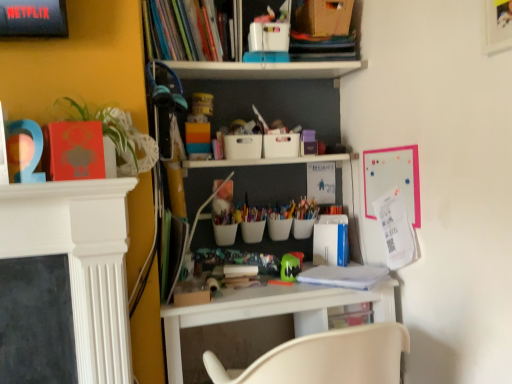
Question: Can you confirm if hardcover books at upper center, which is the 1th book from top to bottom, is taller than white plastic desk at center?

Choices:
 (A) no
 (B) yes

Answer: (A)

Question: Is hardcover books at upper center, which is the 1th book from top to bottom, closer to camera compared to white plastic desk at center?

Choices:
 (A) no
 (B) yes

Answer: (A)

Question: From a real-world perspective, is hardcover books at upper center, which is the first book from left to right, physically above white plastic desk at center?

Choices:
 (A) yes
 (B) no

Answer: (A)

Question: Is hardcover books at upper center, which is the first book from left to right, completely or partially outside of white plastic desk at center?

Choices:
 (A) yes
 (B) no

Answer: (A)

Question: Does hardcover books at upper center, which is the second book in right-to-left order, lie behind white plastic desk at center?

Choices:
 (A) yes
 (B) no

Answer: (A)

Question: Is point (373, 264) positioned closer to the camera than point (377, 302)?

Choices:
 (A) farther
 (B) closer

Answer: (A)

Question: In the image, is white paper at center, the first book from the bottom, on the left side or the right side of white plastic desk at center?

Choices:
 (A) right
 (B) left

Answer: (A)

Question: In terms of size, does white paper at center, the first book from the bottom, appear bigger or smaller than white plastic desk at center?

Choices:
 (A) big
 (B) small

Answer: (B)

Question: From a real-world perspective, is white paper at center, which is the second book in top-to-bottom order, positioned above or below white plastic desk at center?

Choices:
 (A) below
 (B) above

Answer: (B)

Question: Is white plastic desk at center to the left or to the right of white paper at center, the first book from the bottom, in the image?

Choices:
 (A) right
 (B) left

Answer: (B)

Question: From a real-world perspective, is white plastic desk at center positioned above or below white paper at center, the first book from the bottom?

Choices:
 (A) below
 (B) above

Answer: (A)

Question: Is white plastic desk at center inside the boundaries of white paper at center, the first book from the bottom, or outside?

Choices:
 (A) inside
 (B) outside

Answer: (B)

Question: Considering the positions of white plastic desk at center and white paper at center, the first book from the bottom, in the image, is white plastic desk at center wider or thinner than white paper at center, the first book from the bottom,?

Choices:
 (A) wide
 (B) thin

Answer: (A)

Question: In terms of height, does white plastic desk at center look taller or shorter compared to hardcover books at upper center, which is the 1th book from top to bottom?

Choices:
 (A) tall
 (B) short

Answer: (A)

Question: From a real-world perspective, is white plastic desk at center physically located above or below hardcover books at upper center, which ranks as the second book in bottom-to-top order?

Choices:
 (A) below
 (B) above

Answer: (A)